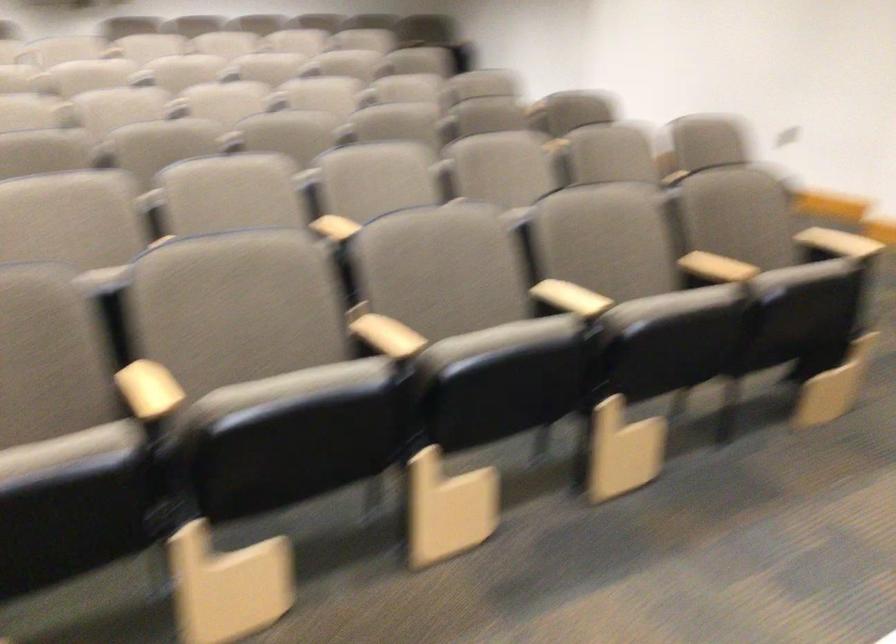
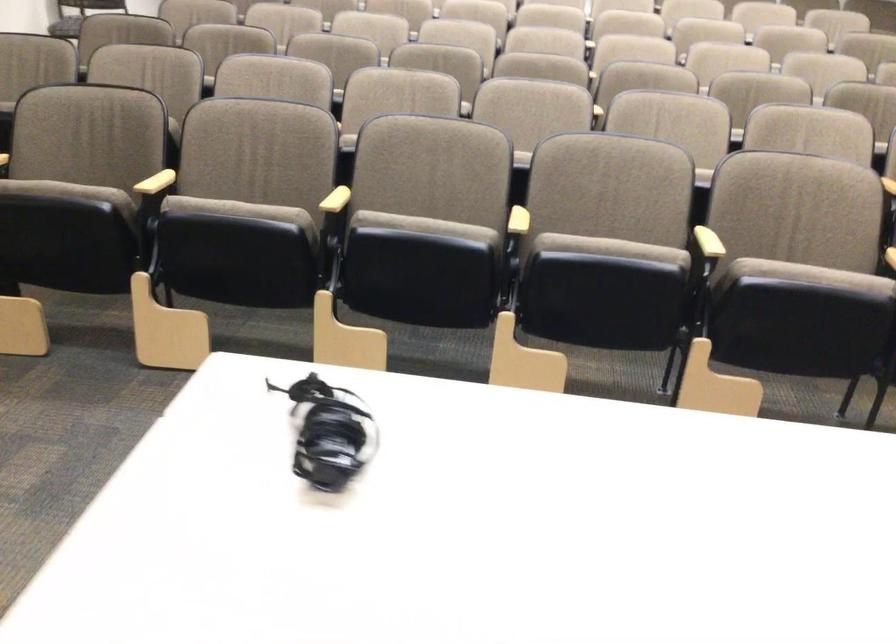
In the second image, find the point that corresponds to the point at 297,393 in the first image.

(424, 225)